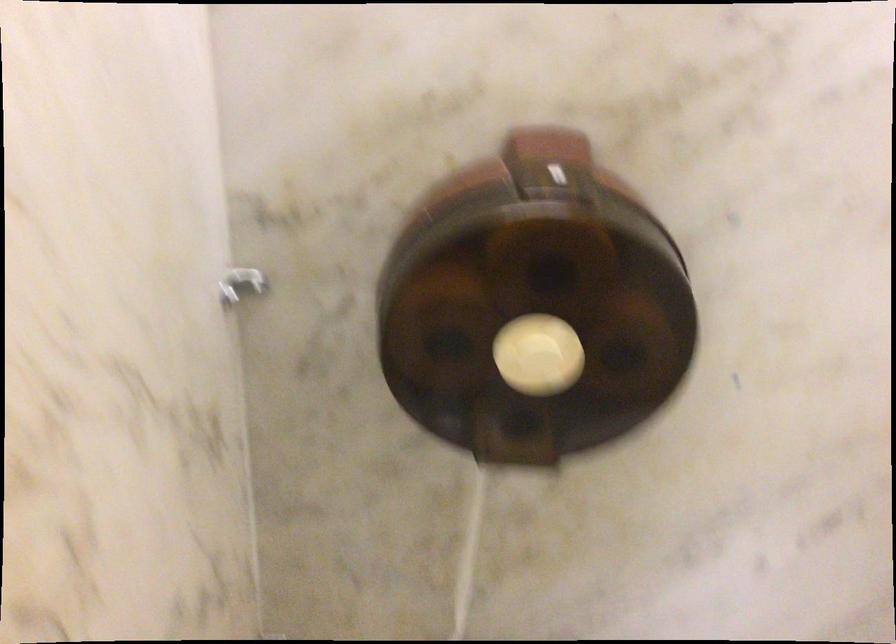
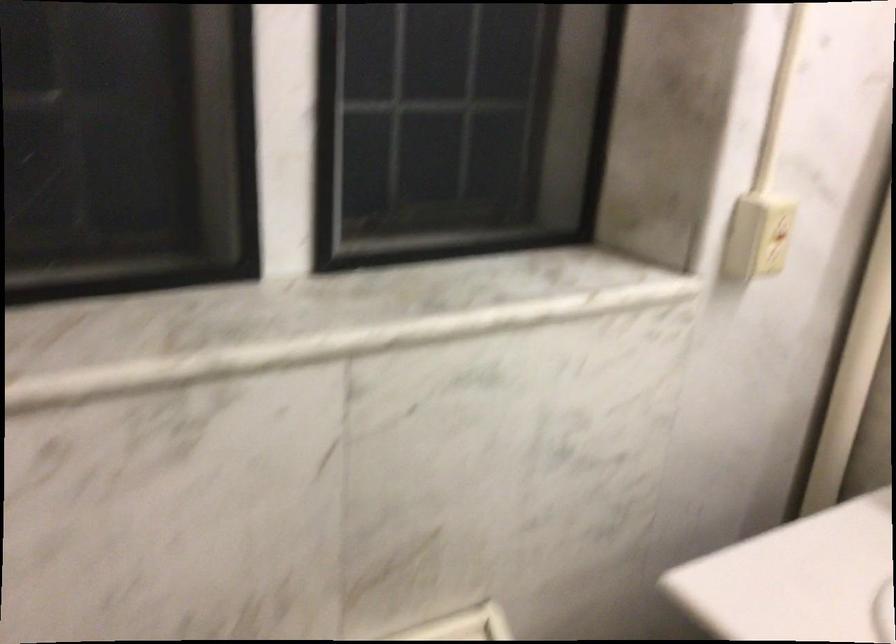
How did the camera likely rotate?

The camera rotated toward right-down.